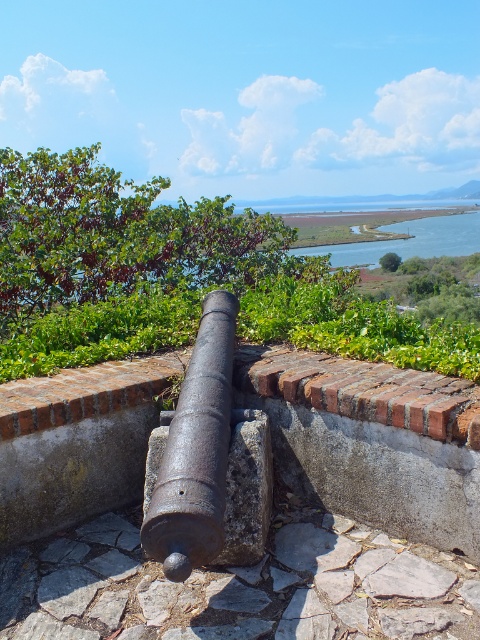
Which is in front, point (149, 520) or point (370, 243)?

Point (149, 520) is in front.

Can you confirm if rusty metal cannon at center is bigger than blue water at center?

No.

Is point (180, 508) closer to viewer compared to point (468, 225)?

Yes, point (180, 508) is closer to viewer.

Locate an element on the screen. rusty metal cannon at center is located at coordinates (210, 461).